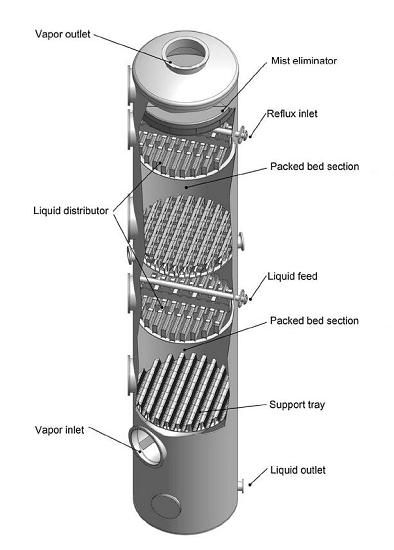
Image resolution: width=394 pixels, height=550 pixels. I want to click on support tray, so click(x=270, y=405).